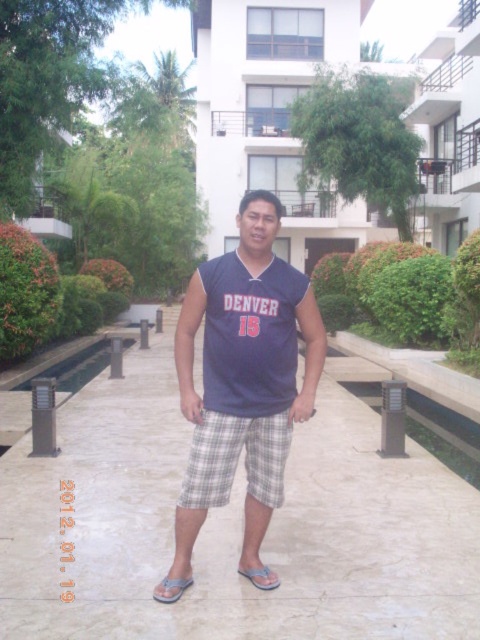
Question: Is white marble pavement at center to the right of navy blue jersey at center from the viewer's perspective?

Choices:
 (A) no
 (B) yes

Answer: (A)

Question: Is white marble pavement at center positioned behind gray fabric sandal at lower center?

Choices:
 (A) no
 (B) yes

Answer: (B)

Question: Which is nearer to the gray plaid shorts at center?

Choices:
 (A) light blue fabric sandal at lower center
 (B) navy blue jersey at center
 (C) white marble pavement at center

Answer: (B)

Question: Considering the real-world distances, which object is closest to the gray plaid shorts at center?

Choices:
 (A) light blue fabric sandal at lower center
 (B) gray fabric sandal at lower center

Answer: (B)

Question: Which point is closer to the camera taking this photo?

Choices:
 (A) (264, 568)
 (B) (372, 492)
 (C) (256, 435)

Answer: (C)

Question: Can you confirm if white marble pavement at center is wider than gray fabric sandal at lower center?

Choices:
 (A) yes
 (B) no

Answer: (A)